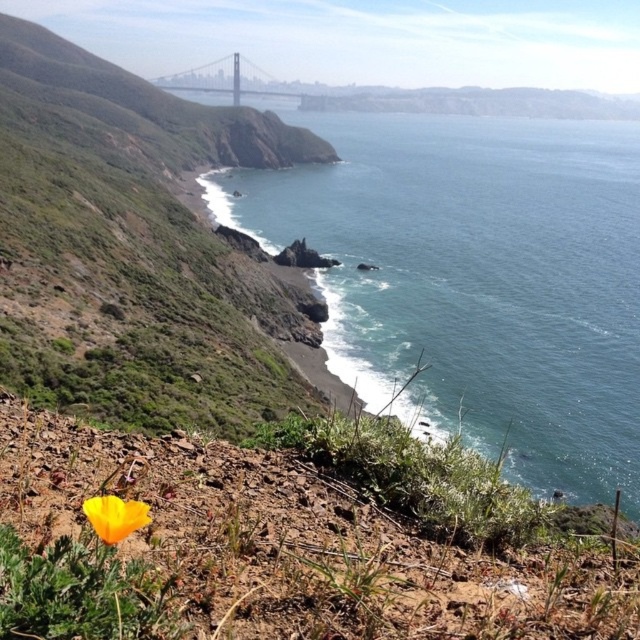
Question: Which object appears closest to the camera in this image?

Choices:
 (A) green grassy hillside at upper left
 (B) blue water at lower right
 (C) metallic gray bridge at center

Answer: (A)

Question: Which point is closer to the camera?

Choices:
 (A) (92, 504)
 (B) (224, 83)
 (C) (339, 291)

Answer: (A)

Question: Is blue water at lower right further to camera compared to yellow matte flower at lower left?

Choices:
 (A) no
 (B) yes

Answer: (B)

Question: Does green grassy hillside at upper left appear on the left side of metallic gray bridge at center?

Choices:
 (A) no
 (B) yes

Answer: (A)

Question: Estimate the real-world distances between objects in this image. Which object is farther from the green grassy hillside at upper left?

Choices:
 (A) blue water at lower right
 (B) yellow matte flower at lower left

Answer: (B)

Question: Is green grassy hillside at upper left wider than yellow matte flower at lower left?

Choices:
 (A) yes
 (B) no

Answer: (A)